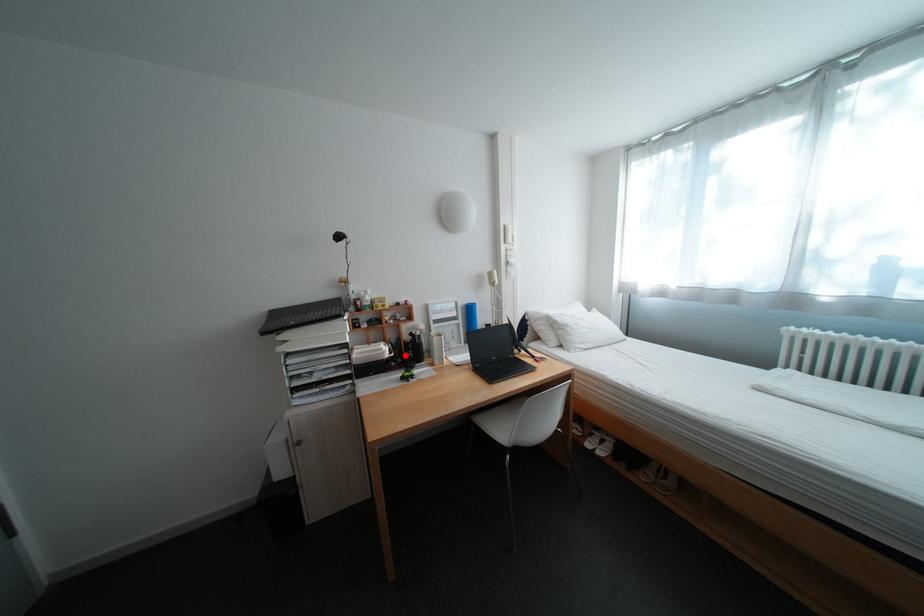
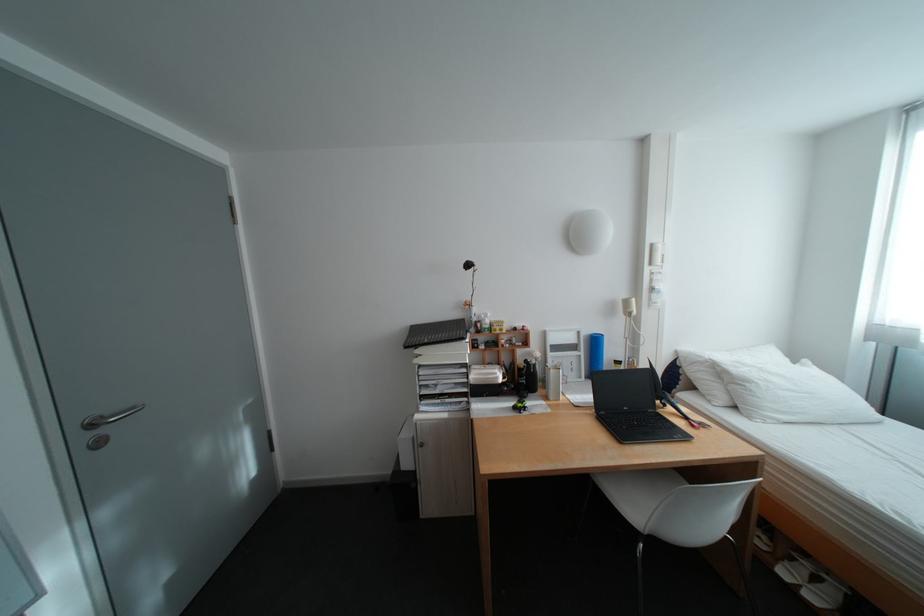
Find the pixel in the second image that matches the highlighted location in the first image.

(518, 381)